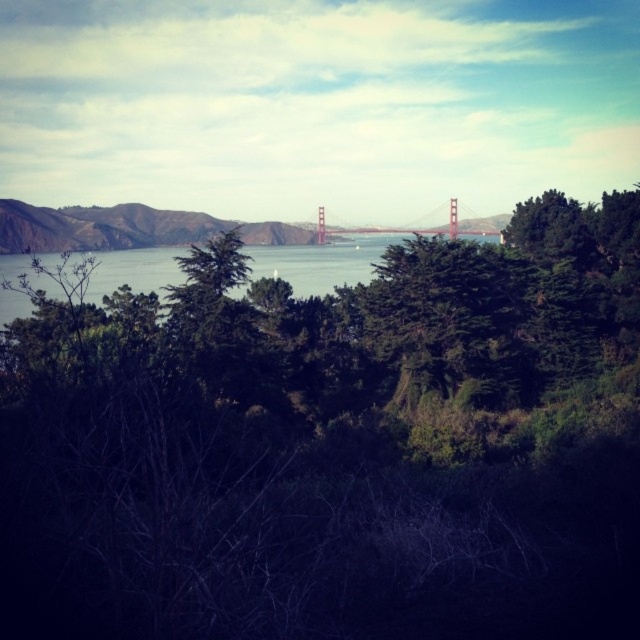
Question: Can you confirm if green leafy tree at center is smaller than blue water at center?

Choices:
 (A) yes
 (B) no

Answer: (B)

Question: Is green leafy tree at center wider than metallic golden bridge at center?

Choices:
 (A) no
 (B) yes

Answer: (B)

Question: Which point appears closest to the camera in this image?

Choices:
 (A) (144, 275)
 (B) (372, 230)

Answer: (A)

Question: Among these points, which one is farthest from the camera?

Choices:
 (A) (385, 228)
 (B) (611, 236)

Answer: (A)

Question: Which point is farther to the camera?

Choices:
 (A) blue water at center
 (B) metallic golden bridge at center
 (C) green leafy tree at center

Answer: (B)

Question: Can you confirm if blue water at center is positioned to the left of metallic golden bridge at center?

Choices:
 (A) no
 (B) yes

Answer: (B)